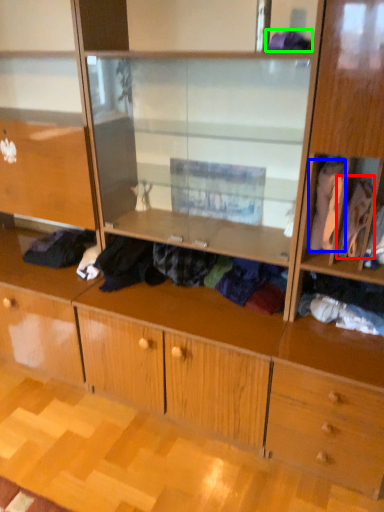
Question: Which object is the farthest from clothing (highlighted by a red box)? Choose among these: clothing (highlighted by a blue box) or clothing (highlighted by a green box).

Choices:
 (A) clothing
 (B) clothing

Answer: (B)